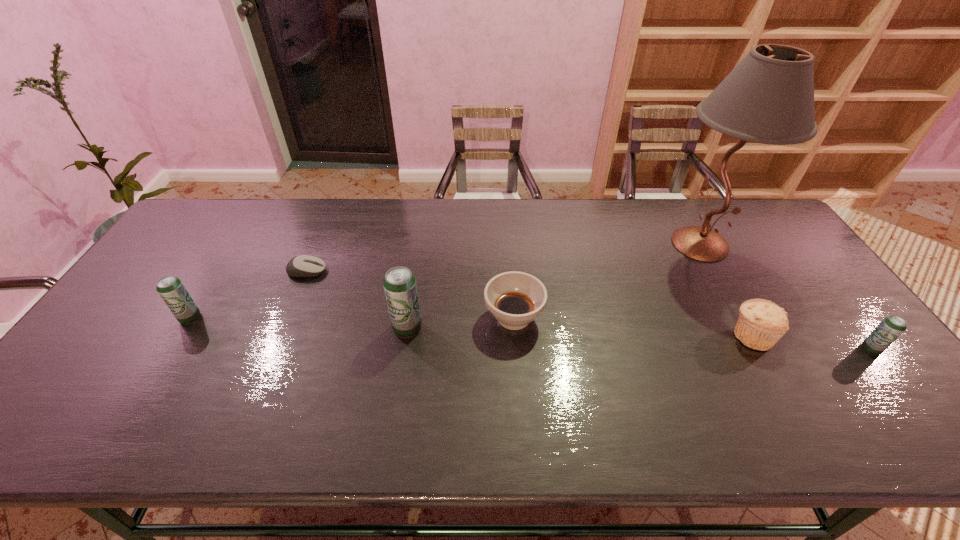
Identify the location of muffin. This screenshot has height=540, width=960. (761, 323).

Identify the location of free space located on the back of the leftmost beer can. The height and width of the screenshot is (540, 960). (243, 233).

At what (x,y) coordinates should I click in order to perform the action: click on free spot located on the left of the second beer can from left to right. Please return your answer as a coordinate pair (x, y). The image size is (960, 540). Looking at the image, I should click on (291, 328).

The height and width of the screenshot is (540, 960). I want to click on vacant region located 0.060m on the front of the nearest beer can, so click(892, 377).

Locate an element on the screen. This screenshot has width=960, height=540. vacant space located on the front-facing side of the table lamp is located at coordinates tap(531, 244).

Find the location of a particular element. vacant point located 0.090m on the front-facing side of the table lamp is located at coordinates (628, 244).

Where is `free region located 0.400m on the front-facing side of the table lamp`? free region located 0.400m on the front-facing side of the table lamp is located at coordinates (531, 244).

Locate an element on the screen. The height and width of the screenshot is (540, 960). free space located on the wheel side of the shortest object is located at coordinates (432, 271).

The width and height of the screenshot is (960, 540). In order to click on vacant space located on the back of the soup bowl in this screenshot , I will do `click(508, 233)`.

The width and height of the screenshot is (960, 540). In order to click on blank space located 0.290m on the back of the muffin in this screenshot , I will do `click(704, 249)`.